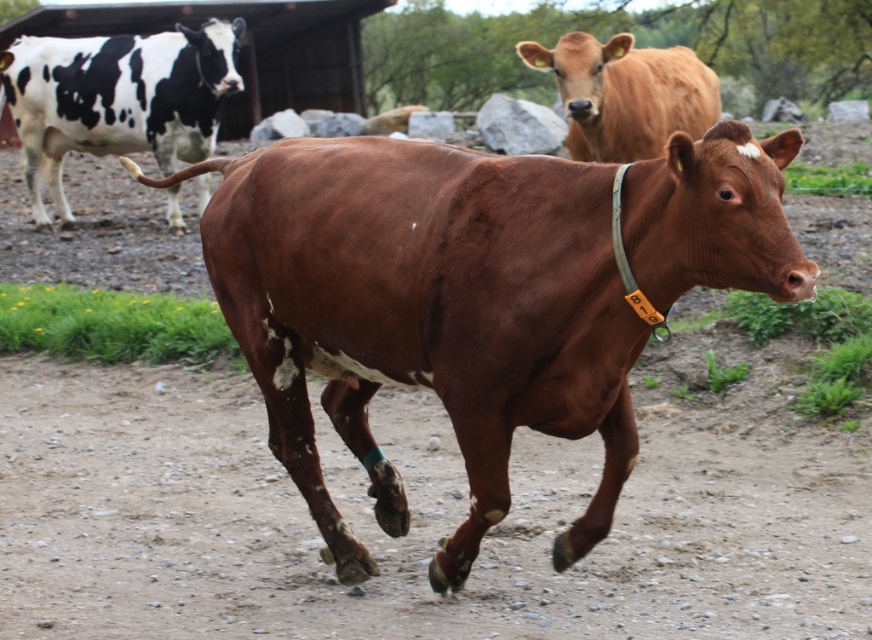
You are a farmer checking on your cows. You see the black and white spotted cow at upper left and the brown smooth cow at upper center. Which cow is closer to you?

The black and white spotted cow at upper left is closer to you because it is further to the viewer than the brown smooth cow at upper center.

You are standing at the point marked as point (117, 99) in the image. Which cow are you on?

The point (117, 99) is located on the black and white spotted cow at upper left.